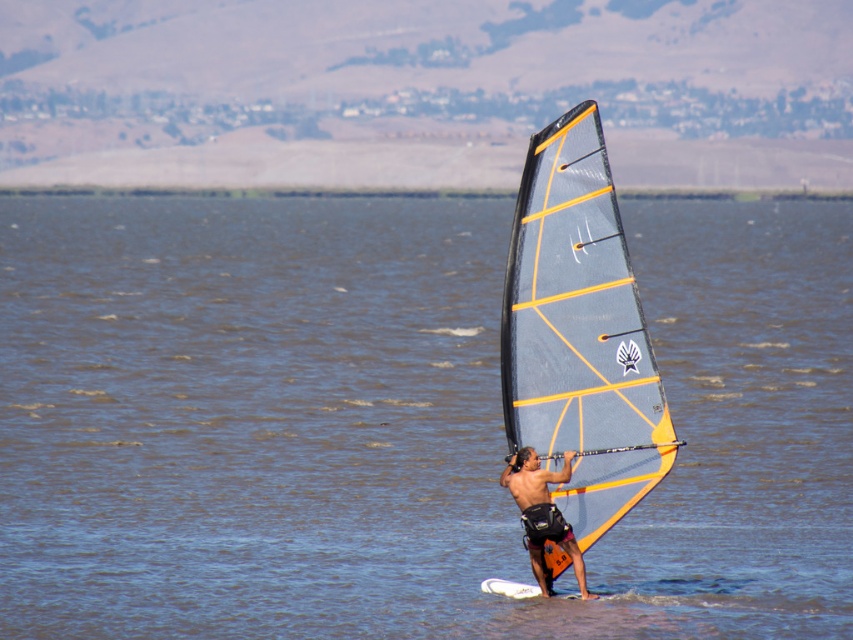
Question: Which point is farther from the camera taking this photo?

Choices:
 (A) (233, 624)
 (B) (523, 467)
 (C) (585, 497)

Answer: (C)

Question: Observing the image, what is the correct spatial positioning of clear blue water at center in reference to matte black wetsuit at center?

Choices:
 (A) above
 (B) below

Answer: (A)

Question: Can you confirm if gray/yellow composite sail at center is positioned above matte black wetsuit at center?

Choices:
 (A) no
 (B) yes

Answer: (B)

Question: Which object is the closest to the gray/yellow composite sail at center?

Choices:
 (A) matte black wetsuit at center
 (B) clear blue water at center

Answer: (A)

Question: Which object is positioned farthest from the matte black wetsuit at center?

Choices:
 (A) clear blue water at center
 (B) gray/yellow composite sail at center

Answer: (A)

Question: Does clear blue water at center lie behind matte black wetsuit at center?

Choices:
 (A) yes
 (B) no

Answer: (B)